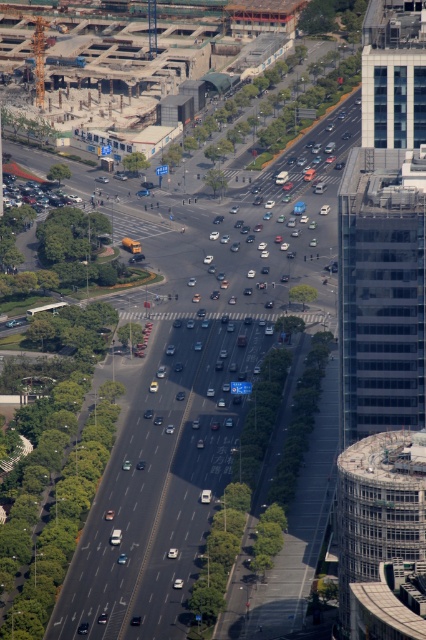
You are a drone operator trying to capture a photo of the glassy blue skyscraper at upper right and the concrete textured building at right. Which one should you adjust your camera focus to first if you want both to be in focus?

The concrete textured building at right is closer to the viewer than the glassy blue skyscraper at upper right, so you should focus on the concrete textured building at right first to ensure both are in focus.

You are a drone operator trying to deliver a package to the transparent glass skyscraper at right. Your drone has a maximum flight height of 100 meters. Can you safely fly over the concrete textured building at right to reach your destination?

The transparent glass skyscraper at right is located above the concrete textured building at right, so yes, the drone can safely fly over the concrete textured building at right to reach the transparent glass skyscraper at right as it is positioned higher.

You are a drone operator flying a drone that needs to capture a photo of the transparent glass skyscraper at right and the concrete textured building at right. Which building should you adjust your drone to focus on first to ensure it appears larger in the photo?

The transparent glass skyscraper at right is closer to the viewer than the concrete textured building at right, so focusing on it first will make it appear larger in the photo.